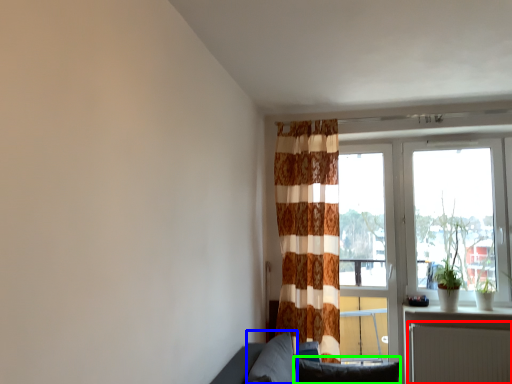
Question: Which object is the farthest from radiator (highlighted by a red box)? Choose among these: pillow (highlighted by a blue box) or pillow (highlighted by a green box).

Choices:
 (A) pillow
 (B) pillow

Answer: (A)